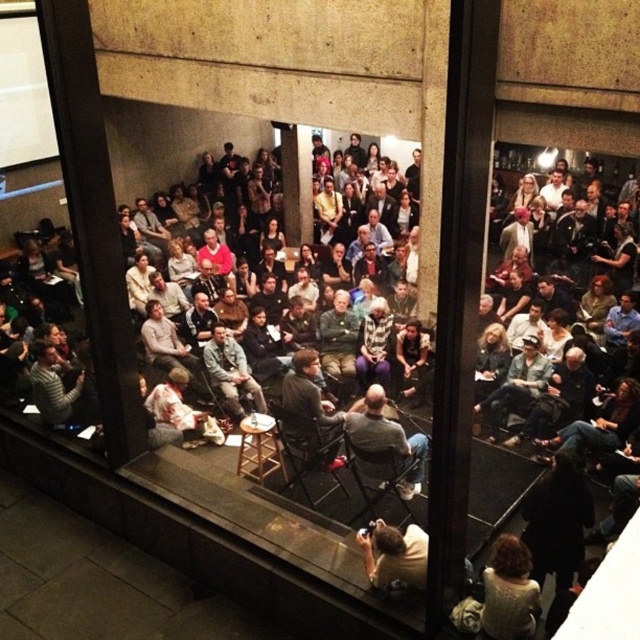
Can you confirm if white knit sweater at lower right is shorter than yellow shirt at center?

Yes, white knit sweater at lower right is shorter than yellow shirt at center.

Can you confirm if white knit sweater at lower right is positioned below yellow shirt at center?

Indeed, white knit sweater at lower right is positioned under yellow shirt at center.

Is point (515, 632) less distant than point (312, 202)?

Yes, point (515, 632) is in front of point (312, 202).

Find the location of `white knit sweater at lower right`. white knit sweater at lower right is located at coordinates (508, 592).

Does white knit sweater at lower right have a lesser width compared to camouflage jacket at center?

Correct, white knit sweater at lower right's width is less than camouflage jacket at center's.

Does white knit sweater at lower right appear on the right side of camouflage jacket at center?

Correct, you'll find white knit sweater at lower right to the right of camouflage jacket at center.

The width and height of the screenshot is (640, 640). Identify the location of white knit sweater at lower right. (508, 592).

Can you confirm if camouflage jacket at center is smaller than striped sweater at center?

Indeed, camouflage jacket at center has a smaller size compared to striped sweater at center.

Is point (209, 340) positioned behind point (38, 378)?

Yes, point (209, 340) is farther from viewer.

Image resolution: width=640 pixels, height=640 pixels. In order to click on camouflage jacket at center in this screenshot , I will do `click(230, 371)`.